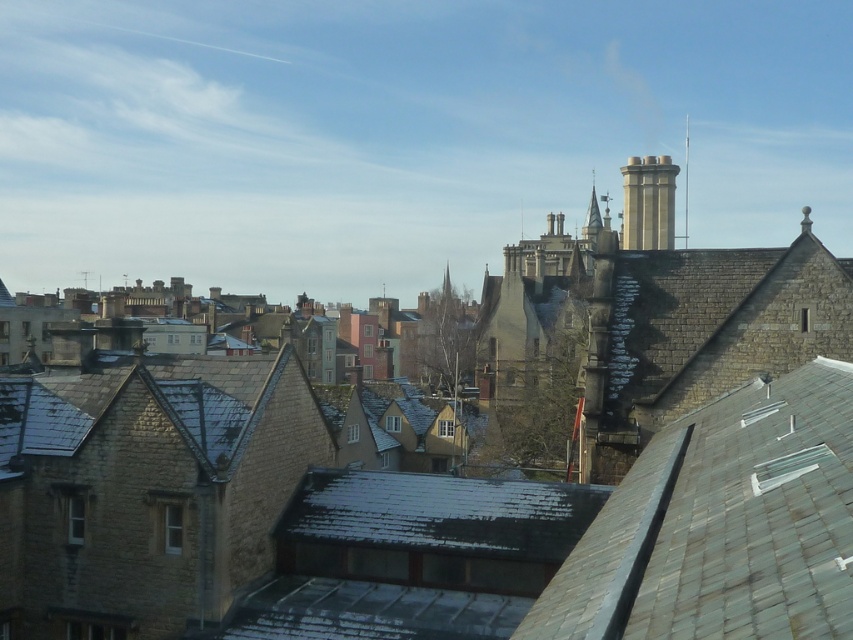
Is point (659, 156) positioned after point (685, 188)?

That is False.

Between stone chimney at upper right and smooth stone spire at upper center, which one appears on the right side from the viewer's perspective?

Positioned to the right is smooth stone spire at upper center.

Does point (631, 246) come closer to viewer compared to point (688, 188)?

Yes, point (631, 246) is in front of point (688, 188).

Find the location of a particular element. stone chimney at upper right is located at coordinates (648, 202).